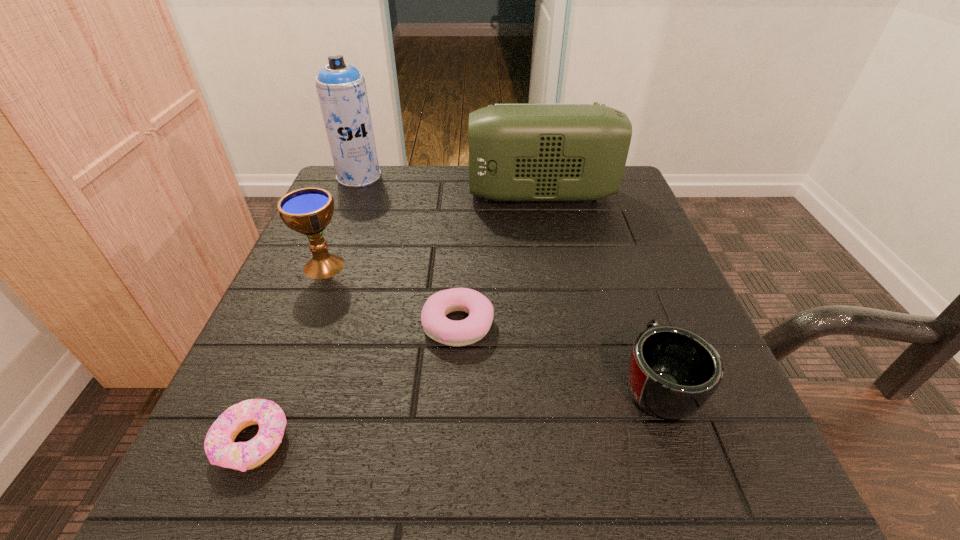
Identify the location of free location located on the front-facing side of the radio_receiver. [x=396, y=195].

You are a GUI agent. You are given a task and a screenshot of the screen. Output one action in this format:
    pyautogui.click(x=<x>, y=<y>)
    Task: Click on the vacant space located 0.320m on the back of the chalice
    The height and width of the screenshot is (540, 960).
    Given the screenshot: What is the action you would take?
    click(363, 171)

You are a GUI agent. You are given a task and a screenshot of the screen. Output one action in this format:
    pyautogui.click(x=<x>, y=<y>)
    Task: Click on the vacant space situated 0.050m on the side of the mug with the handle
    
    Given the screenshot: What is the action you would take?
    pyautogui.click(x=634, y=320)

Find the location of `free point located on the side of the mug with the handle`. free point located on the side of the mug with the handle is located at coordinates (605, 237).

At what (x,y) coordinates should I click in order to perform the action: click on vacant space positioned on the side of the mug with the handle. Please return your answer as a coordinate pair (x, y). This screenshot has height=540, width=960. Looking at the image, I should click on (598, 217).

In order to click on vacant area situated 0.380m on the back of the pastry in this screenshot , I will do `click(465, 187)`.

At what (x,y) coordinates should I click in order to perform the action: click on blank space located 0.130m on the back of the shortest object. Please return your answer as a coordinate pair (x, y). Looking at the image, I should click on (295, 336).

Locate an element on the screen. aerosol can positioned at the far edge is located at coordinates [x=341, y=88].

The height and width of the screenshot is (540, 960). In order to click on radio_receiver at the far edge in this screenshot , I will do `click(517, 151)`.

Image resolution: width=960 pixels, height=540 pixels. I want to click on object at the near edge, so click(x=219, y=445).